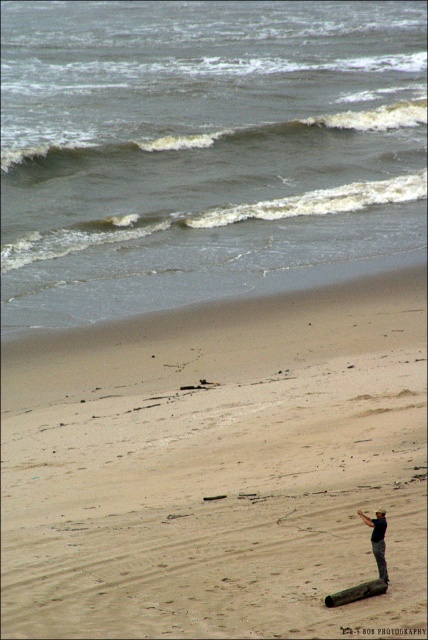
Question: Considering the real-world distances, which object is closest to the sandy beach at lower center?

Choices:
 (A) dark blue fabric at lower right
 (B) brown wood log at lower right

Answer: (B)

Question: Can you confirm if sandy beach at lower center is smaller than dark blue fabric at lower right?

Choices:
 (A) no
 (B) yes

Answer: (A)

Question: Is sandy beach at lower center above dark blue fabric at lower right?

Choices:
 (A) no
 (B) yes

Answer: (B)

Question: Based on their relative distances, which object is farther from the sandy beach at lower center?

Choices:
 (A) brown wood log at lower right
 (B) dark blue fabric at lower right

Answer: (B)

Question: Which of the following is the closest to the observer?

Choices:
 (A) (100, 500)
 (B) (372, 538)
 (C) (374, 580)

Answer: (C)

Question: Is dark blue fabric at lower right below brown wood log at lower right?

Choices:
 (A) yes
 (B) no

Answer: (B)